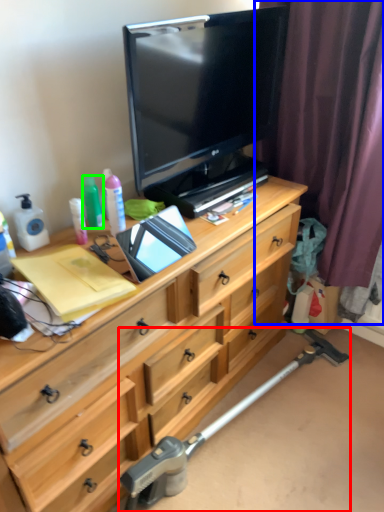
Question: Which object is the closest to the crutch (highlighted by a red box)? Choose among these: curtain (highlighted by a blue box) or bottle (highlighted by a green box).

Choices:
 (A) curtain
 (B) bottle

Answer: (A)